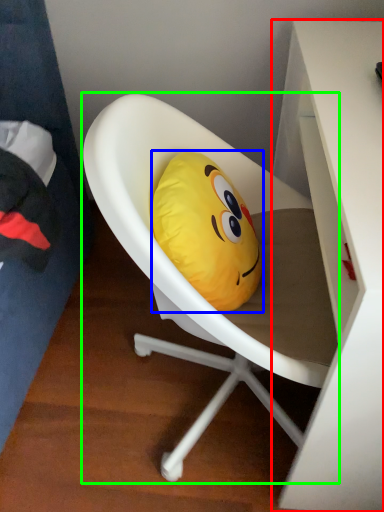
Question: Which is farther away from desk (highlighted by a red box)? pillow (highlighted by a blue box) or chair (highlighted by a green box)?

Choices:
 (A) pillow
 (B) chair

Answer: (A)